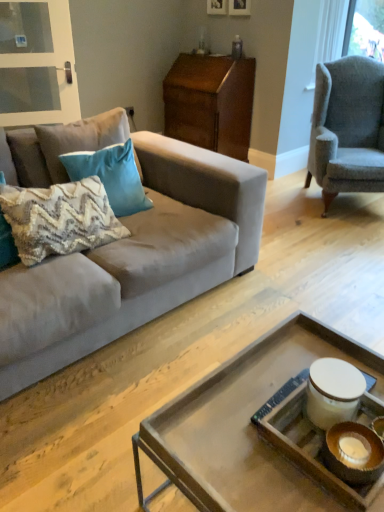
Question: Which direction should I rotate to look at wooden picture frame at upper center, marked as the first picture frame in a right-to-left arrangement?

Choices:
 (A) left
 (B) right

Answer: (B)

Question: From a real-world perspective, is gray woolen armchair at right physically below teal velvet pillow at upper left, which ranks as the 2th pillow in front-to-back order?

Choices:
 (A) no
 (B) yes

Answer: (B)

Question: Considering the relative positions of gray woolen armchair at right and teal velvet pillow at upper left, placed as the second pillow when sorted from back to front, in the image provided, is gray woolen armchair at right in front of teal velvet pillow at upper left, placed as the second pillow when sorted from back to front,?

Choices:
 (A) no
 (B) yes

Answer: (A)

Question: Is gray woolen armchair at right at the right side of teal velvet pillow at upper left, which ranks as the 2th pillow in front-to-back order?

Choices:
 (A) no
 (B) yes

Answer: (B)

Question: Is gray woolen armchair at right not inside teal velvet pillow at upper left, which ranks as the 2th pillow in front-to-back order?

Choices:
 (A) no
 (B) yes

Answer: (B)

Question: From a real-world perspective, is gray woolen armchair at right on teal velvet pillow at upper left, placed as the second pillow when sorted from back to front?

Choices:
 (A) yes
 (B) no

Answer: (B)

Question: Considering the relative sizes of gray woolen armchair at right and teal velvet pillow at upper left, which ranks as the 2th pillow in front-to-back order, in the image provided, is gray woolen armchair at right taller than teal velvet pillow at upper left, which ranks as the 2th pillow in front-to-back order,?

Choices:
 (A) yes
 (B) no

Answer: (A)

Question: Does gray woolen armchair at right lie in front of wooden tray at center?

Choices:
 (A) yes
 (B) no

Answer: (B)

Question: Does gray woolen armchair at right have a lesser height compared to wooden tray at center?

Choices:
 (A) yes
 (B) no

Answer: (B)

Question: Is gray woolen armchair at right bigger than wooden tray at center?

Choices:
 (A) yes
 (B) no

Answer: (A)

Question: From the image's perspective, would you say gray woolen armchair at right is positioned over wooden tray at center?

Choices:
 (A) yes
 (B) no

Answer: (A)

Question: Does gray woolen armchair at right have a lesser width compared to wooden tray at center?

Choices:
 (A) no
 (B) yes

Answer: (A)

Question: Considering the relative sizes of gray woolen armchair at right and wooden tray at center in the image provided, is gray woolen armchair at right smaller than wooden tray at center?

Choices:
 (A) yes
 (B) no

Answer: (B)

Question: Can you confirm if textured beige pillow at left, marked as the 3th pillow in a back-to-front arrangement, is bigger than wooden picture frame at upper center, placed as the second picture frame when sorted from right to left?

Choices:
 (A) yes
 (B) no

Answer: (A)